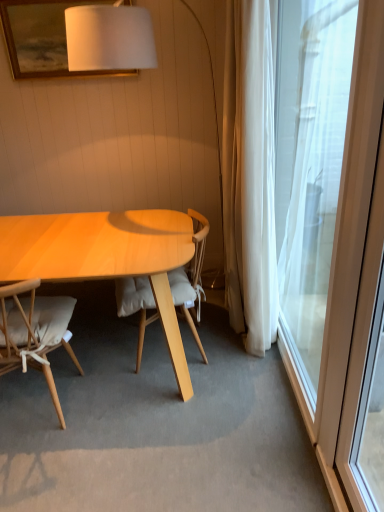
Image resolution: width=384 pixels, height=512 pixels. In order to click on free spot to the left of light wood/wooden chair at center, the 2th chair in the left-to-right sequence in this screenshot , I will do `click(91, 344)`.